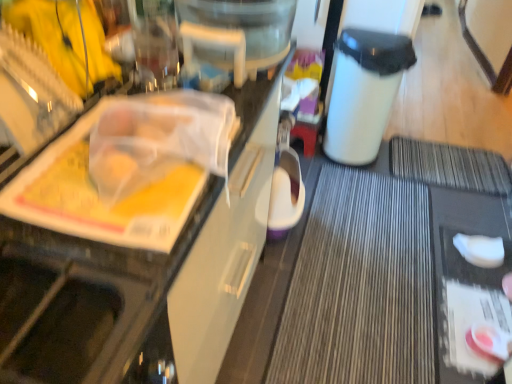
What is the approximate width of white matte sponge at lower right, arranged as the second food when viewed from the front?

The width of white matte sponge at lower right, arranged as the second food when viewed from the front, is 9.05 inches.

Describe the element at coordinates (364, 92) in the screenshot. I see `white plastic trash bin at center-right` at that location.

Image resolution: width=512 pixels, height=384 pixels. What do you see at coordinates (488, 342) in the screenshot?
I see `pink glossy jar at lower right, which is the second food from back to front` at bounding box center [488, 342].

Where is `white matte sponge at lower right, which ranks as the 2th food in bottom-to-top order`? The height and width of the screenshot is (384, 512). white matte sponge at lower right, which ranks as the 2th food in bottom-to-top order is located at coordinates (480, 250).

Between pink glossy jar at lower right, the second food in the top-to-bottom sequence, and white plastic trash bin at center-right, which one appears on the right side from the viewer's perspective?

From the viewer's perspective, pink glossy jar at lower right, the second food in the top-to-bottom sequence, appears more on the right side.

Considering the relative sizes of pink glossy jar at lower right, which appears as the first food when ordered from the bottom, and white plastic trash bin at center-right in the image provided, is pink glossy jar at lower right, which appears as the first food when ordered from the bottom, taller than white plastic trash bin at center-right?

No, pink glossy jar at lower right, which appears as the first food when ordered from the bottom, is not taller than white plastic trash bin at center-right.

Consider the image. How many degrees apart are the facing directions of pink glossy jar at lower right, which appears as the first food when ordered from the bottom, and white plastic trash bin at center-right?

The angular difference between pink glossy jar at lower right, which appears as the first food when ordered from the bottom, and white plastic trash bin at center-right is 111 degrees.

From the image's perspective, is white plastic trash bin at center-right on pink glossy jar at lower right, the second food in the top-to-bottom sequence?

Yes, from the image's perspective, white plastic trash bin at center-right is over pink glossy jar at lower right, the second food in the top-to-bottom sequence.

From their relative heights in the image, would you say white plastic trash bin at center-right is taller or shorter than pink glossy jar at lower right, the second food in the top-to-bottom sequence?

In the image, white plastic trash bin at center-right appears to be taller than pink glossy jar at lower right, the second food in the top-to-bottom sequence.

Which is more to the left, white plastic trash bin at center-right or pink glossy jar at lower right, which is the second food from back to front?

Positioned to the left is white plastic trash bin at center-right.

Are white plastic trash bin at center-right and pink glossy jar at lower right, marked as the first food in a front-to-back arrangement, located far from each other?

Yes, white plastic trash bin at center-right and pink glossy jar at lower right, marked as the first food in a front-to-back arrangement, are quite far apart.

From their relative heights in the image, would you say white matte sponge at lower right, the 1th food in the top-to-bottom sequence, is taller or shorter than pink glossy jar at lower right, which appears as the first food when ordered from the bottom?

Clearly, white matte sponge at lower right, the 1th food in the top-to-bottom sequence, is shorter compared to pink glossy jar at lower right, which appears as the first food when ordered from the bottom.

Is white matte sponge at lower right, arranged as the second food when viewed from the front, situated inside pink glossy jar at lower right, which appears as the first food when ordered from the bottom, or outside?

white matte sponge at lower right, arranged as the second food when viewed from the front, is spatially situated outside pink glossy jar at lower right, which appears as the first food when ordered from the bottom.

Does point (495, 242) appear closer or farther from the camera than point (487, 345)?

Point (495, 242) is farther from the camera than point (487, 345).

Is white matte sponge at lower right, the 1th food in the top-to-bottom sequence, placed right next to pink glossy jar at lower right, which appears as the first food when ordered from the bottom?

No.

Identify the location of trash bin/can located behind the white plastic tray at upper left. The height and width of the screenshot is (384, 512). (364, 92).

From a real-world perspective, is white plastic tray at upper left above or below white plastic trash bin at center-right?

From a real-world perspective, white plastic tray at upper left is physically above white plastic trash bin at center-right.

Based on the photo, is white plastic tray at upper left taller than white plastic trash bin at center-right?

Yes, white plastic tray at upper left is taller than white plastic trash bin at center-right.

Which is farther from the camera, (61, 249) or (353, 147)?

Positioned behind is point (353, 147).

Considering the relative sizes of pink glossy jar at lower right, which appears as the first food when ordered from the bottom, and white matte sponge at lower right, which ranks as the 2th food in bottom-to-top order, in the image provided, is pink glossy jar at lower right, which appears as the first food when ordered from the bottom, taller than white matte sponge at lower right, which ranks as the 2th food in bottom-to-top order,?

Indeed, pink glossy jar at lower right, which appears as the first food when ordered from the bottom, has a greater height compared to white matte sponge at lower right, which ranks as the 2th food in bottom-to-top order.

This screenshot has height=384, width=512. I want to click on food on the left of white matte sponge at lower right, the 1th food in the top-to-bottom sequence, so click(x=488, y=342).

From a real-world perspective, which is physically below, pink glossy jar at lower right, which appears as the first food when ordered from the bottom, or white matte sponge at lower right, which appears as the first food when viewed from the back?

In real-world perspective, white matte sponge at lower right, which appears as the first food when viewed from the back, is lower.

Between pink glossy jar at lower right, which appears as the first food when ordered from the bottom, and white matte sponge at lower right, arranged as the second food when viewed from the front, which one has larger size?

pink glossy jar at lower right, which appears as the first food when ordered from the bottom, is bigger.

Is white plastic trash bin at center-right to the right of white matte sponge at lower right, which appears as the first food when viewed from the back, from the viewer's perspective?

In fact, white plastic trash bin at center-right is to the left of white matte sponge at lower right, which appears as the first food when viewed from the back.

At what (x,y) coordinates should I click in order to perform the action: click on trash bin/can that is above the white matte sponge at lower right, which appears as the first food when viewed from the back (from the image's perspective). Please return your answer as a coordinate pair (x, y). The height and width of the screenshot is (384, 512). Looking at the image, I should click on (364, 92).

Who is taller, white plastic trash bin at center-right or white matte sponge at lower right, which appears as the first food when viewed from the back?

Standing taller between the two is white plastic trash bin at center-right.

Which is behind, white plastic trash bin at center-right or white matte sponge at lower right, the 1th food in the top-to-bottom sequence?

white plastic trash bin at center-right is behind.

Considering the positions of objects white matte sponge at lower right, arranged as the second food when viewed from the front, and white plastic trash bin at center-right in the image provided, who is behind, white matte sponge at lower right, arranged as the second food when viewed from the front, or white plastic trash bin at center-right?

white plastic trash bin at center-right is further from the camera.

Would you say white plastic trash bin at center-right is part of white matte sponge at lower right, which appears as the first food when viewed from the back,'s contents?

That's incorrect, white plastic trash bin at center-right is not inside white matte sponge at lower right, which appears as the first food when viewed from the back.

From the image's perspective, is white matte sponge at lower right, the 1th food in the top-to-bottom sequence, located above or below white plastic trash bin at center-right?

white matte sponge at lower right, the 1th food in the top-to-bottom sequence, is below white plastic trash bin at center-right.

From a real-world perspective, is white matte sponge at lower right, the 1th food in the top-to-bottom sequence, under white plastic trash bin at center-right?

Yes, from a real-world perspective, white matte sponge at lower right, the 1th food in the top-to-bottom sequence, is below white plastic trash bin at center-right.

Find the location of a particular element. This screenshot has height=384, width=512. trash bin/can above the pink glossy jar at lower right, marked as the first food in a front-to-back arrangement (from a real-world perspective) is located at coordinates (364, 92).

Identify the location of trash bin/can above the pink glossy jar at lower right, the second food in the top-to-bottom sequence (from the image's perspective). This screenshot has height=384, width=512. (364, 92).

Estimate the real-world distances between objects in this image. Which object is closer to white plastic tray at upper left, white plastic trash bin at center-right or pink glossy jar at lower right, which appears as the first food when ordered from the bottom?

white plastic trash bin at center-right lies closer to white plastic tray at upper left than the other object.

Looking at the image, which one is located further to white matte sponge at lower right, which ranks as the 2th food in bottom-to-top order, white plastic trash bin at center-right or pink glossy jar at lower right, marked as the first food in a front-to-back arrangement?

white plastic trash bin at center-right is further to white matte sponge at lower right, which ranks as the 2th food in bottom-to-top order.

From the image, which object appears to be farther from white plastic trash bin at center-right, white plastic tray at upper left or pink glossy jar at lower right, which is the second food from back to front?

white plastic tray at upper left is further to white plastic trash bin at center-right.

From the image, which object appears to be nearer to white matte sponge at lower right, which ranks as the 2th food in bottom-to-top order, pink glossy jar at lower right, the second food in the top-to-bottom sequence, or white plastic trash bin at center-right?

Based on the image, pink glossy jar at lower right, the second food in the top-to-bottom sequence, appears to be nearer to white matte sponge at lower right, which ranks as the 2th food in bottom-to-top order.

Considering their positions, is pink glossy jar at lower right, marked as the first food in a front-to-back arrangement, positioned further to white plastic trash bin at center-right than white matte sponge at lower right, the 1th food in the top-to-bottom sequence?

pink glossy jar at lower right, marked as the first food in a front-to-back arrangement, lies further to white plastic trash bin at center-right than the other object.

When comparing their distances from white matte sponge at lower right, which ranks as the 2th food in bottom-to-top order, does white plastic tray at upper left or white plastic trash bin at center-right seem further?

Based on the image, white plastic tray at upper left appears to be further to white matte sponge at lower right, which ranks as the 2th food in bottom-to-top order.

Looking at the image, which one is located closer to white plastic tray at upper left, white plastic trash bin at center-right or white matte sponge at lower right, which appears as the first food when viewed from the back?

Based on the image, white plastic trash bin at center-right appears to be nearer to white plastic tray at upper left.

Considering their positions, is pink glossy jar at lower right, which appears as the first food when ordered from the bottom, positioned further to white matte sponge at lower right, which appears as the first food when viewed from the back, than white plastic tray at upper left?

The object further to white matte sponge at lower right, which appears as the first food when viewed from the back, is white plastic tray at upper left.

Locate an element on the screen. food located between white plastic tray at upper left and white matte sponge at lower right, which appears as the first food when viewed from the back, in the left-right direction is located at coordinates pyautogui.click(x=488, y=342).

At what (x,y) coordinates should I click in order to perform the action: click on food between white plastic trash bin at center-right and pink glossy jar at lower right, which is the second food from back to front, in the up-down direction. Please return your answer as a coordinate pair (x, y). The height and width of the screenshot is (384, 512). Looking at the image, I should click on (480, 250).